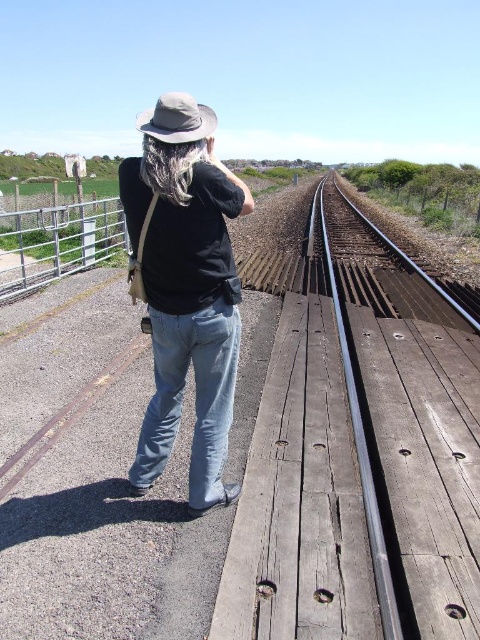
Question: Observing the image, what is the correct spatial positioning of smooth metal train track at center in reference to black cotton shirt at center?

Choices:
 (A) below
 (B) above

Answer: (B)

Question: Among these points, which one is nearest to the camera?

Choices:
 (A) (119, 211)
 (B) (159, 433)
 (C) (189, 132)

Answer: (C)

Question: Among these objects, which one is nearest to the camera?

Choices:
 (A) metallic gate at left
 (B) black cotton shirt at center
 (C) smooth metal train track at center

Answer: (C)

Question: Is metallic gate at left to the right of khaki fabric cowboy hat at upper center from the viewer's perspective?

Choices:
 (A) yes
 (B) no

Answer: (B)

Question: Does smooth metal train track at center lie in front of khaki fabric cowboy hat at upper center?

Choices:
 (A) yes
 (B) no

Answer: (A)

Question: Which object appears closest to the camera in this image?

Choices:
 (A) smooth metal train track at center
 (B) black cotton shirt at center

Answer: (A)